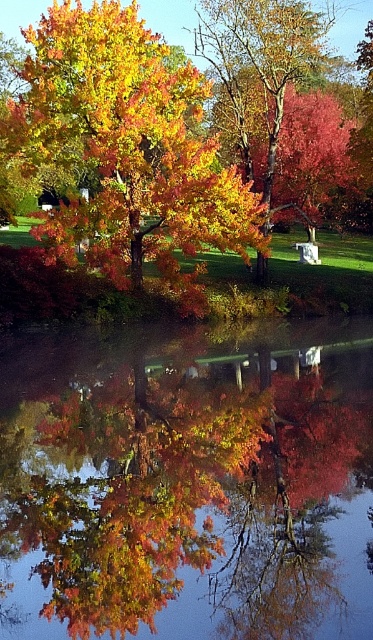
Who is higher up, glossy reflective water at center or shiny golden leaves at center?

shiny golden leaves at center

Can you confirm if glossy reflective water at center is positioned below shiny golden leaves at center?

Correct, glossy reflective water at center is located below shiny golden leaves at center.

This screenshot has height=640, width=373. In order to click on glossy reflective water at center in this screenshot , I will do `click(186, 483)`.